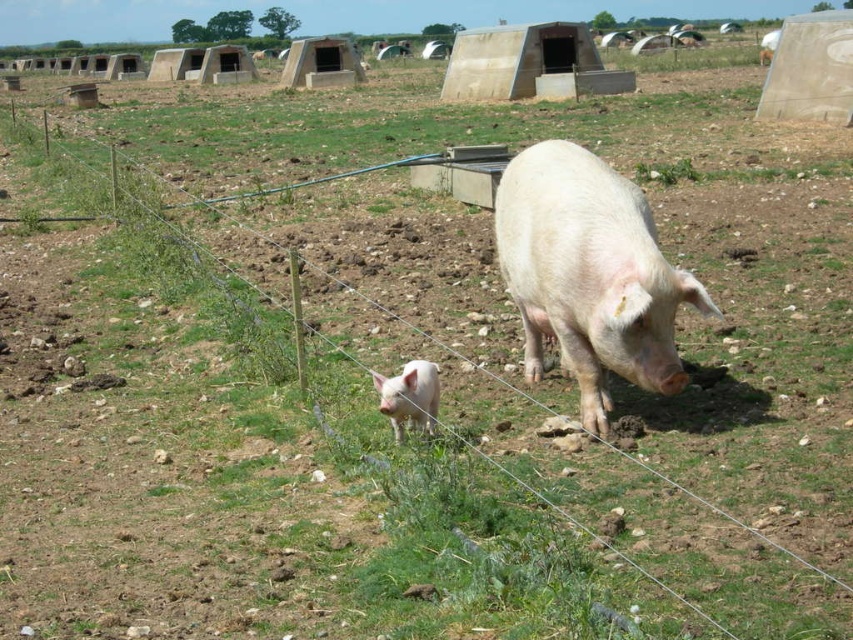
Question: Which of the following is the farthest from the observer?

Choices:
 (A) pink smooth pig at center
 (B) white matte piglet at lower center

Answer: (B)

Question: Which point is closer to the camera taking this photo?

Choices:
 (A) (578, 172)
 (B) (422, 424)

Answer: (B)

Question: Does pink smooth pig at center have a smaller size compared to white matte piglet at lower center?

Choices:
 (A) no
 (B) yes

Answer: (A)

Question: Can you confirm if pink smooth pig at center is positioned to the right of white matte piglet at lower center?

Choices:
 (A) no
 (B) yes

Answer: (B)

Question: Considering the relative positions of pink smooth pig at center and white matte piglet at lower center in the image provided, where is pink smooth pig at center located with respect to white matte piglet at lower center?

Choices:
 (A) above
 (B) below

Answer: (A)